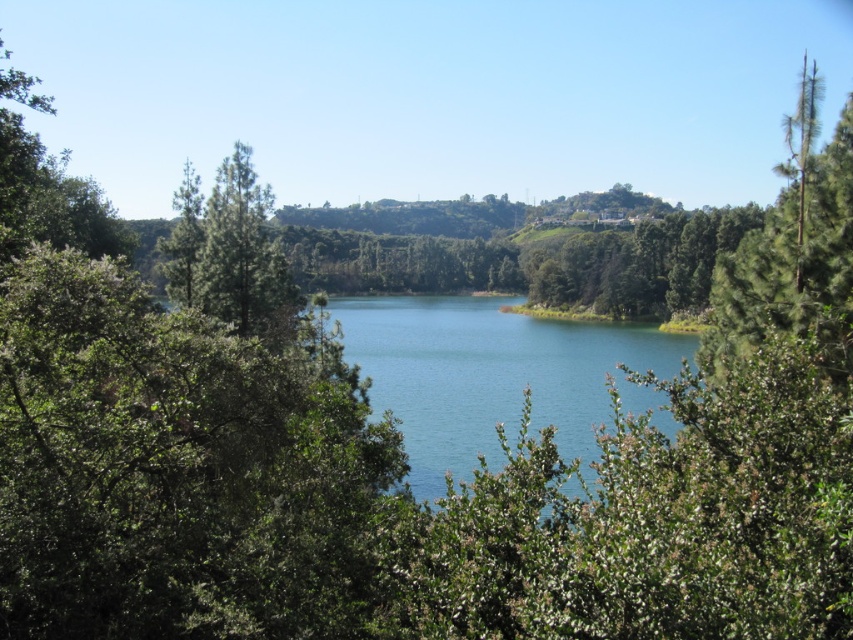
In the scene shown: You are standing at the edge of the lake and want to take a photo of both the clear blue water at center and the green rough bark tree at right. Which object should you position closer to the left side of your camera frame?

You should position the clear blue water at center closer to the left side of your camera frame since it is already to the left of the green rough bark tree at right.

You are an environmental scientist studying the landscape. You observe the green rough bark tree at right and the clear blue water at center. Which object is closer to the observer?

The clear blue water at center is closer to the observer because the green rough bark tree at right is positioned behind it.

Consider the image. You are an environmental scientist assessing the landscape. You need to determine which area is smaller in the image between the clear blue water at center and the green rough bark tree at right. Which one is smaller?

The clear blue water at center occupies less space than the green rough bark tree at right, so the clear blue water at center is smaller.